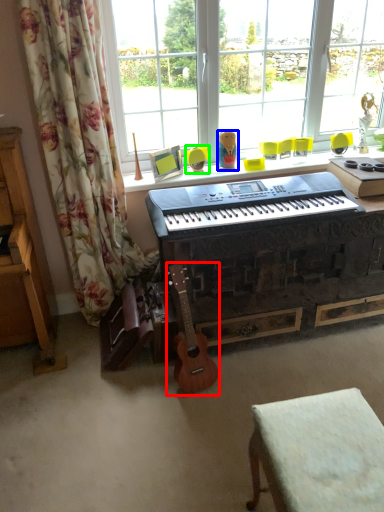
Question: Based on their relative distances, which object is nearer to guitar (highlighted by a red box)? Choose from toy (highlighted by a blue box) and armchair (highlighted by a green box).

Choices:
 (A) toy
 (B) armchair

Answer: (B)